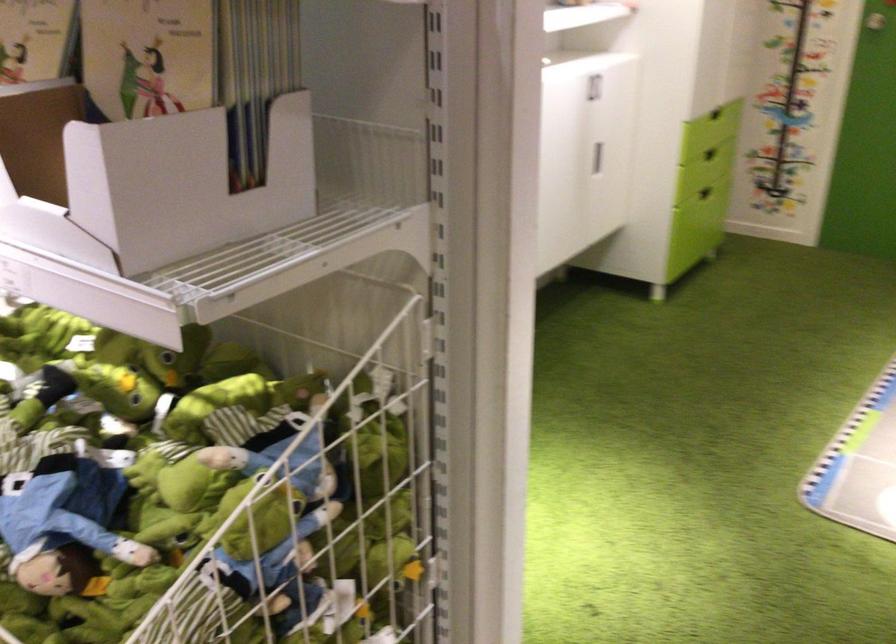
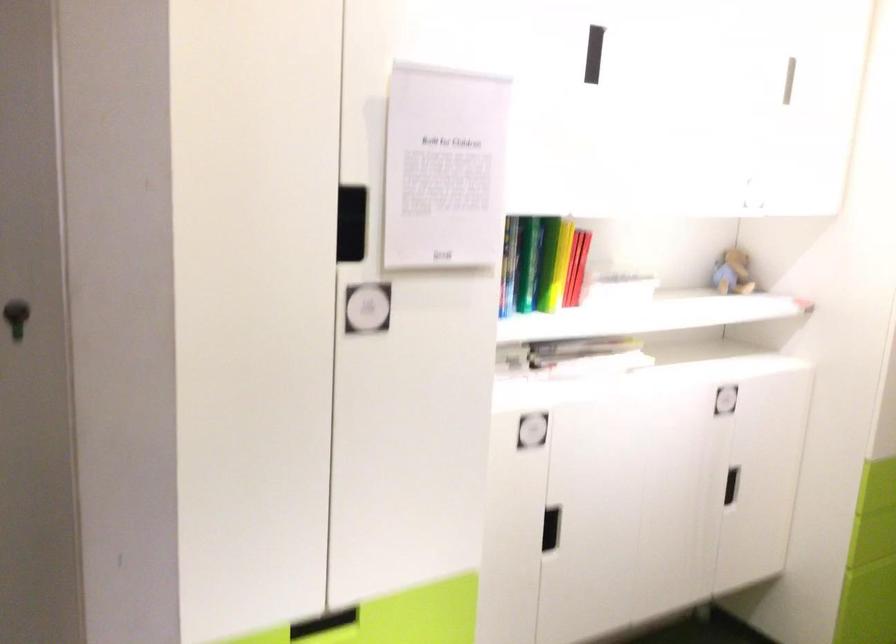
Question: How did the camera likely rotate?

Choices:
 (A) Left
 (B) Right
 (C) Up
 (D) Down

Answer: (A)